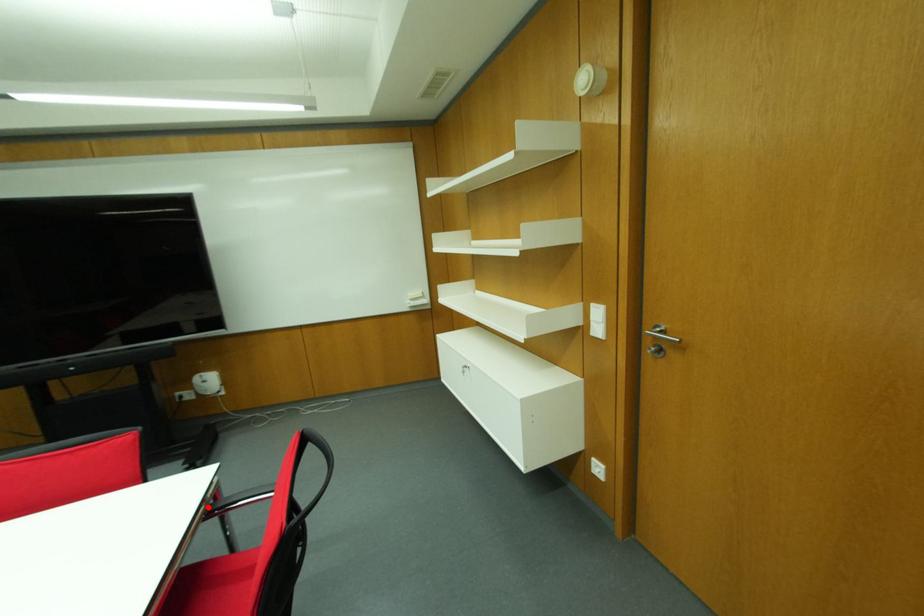
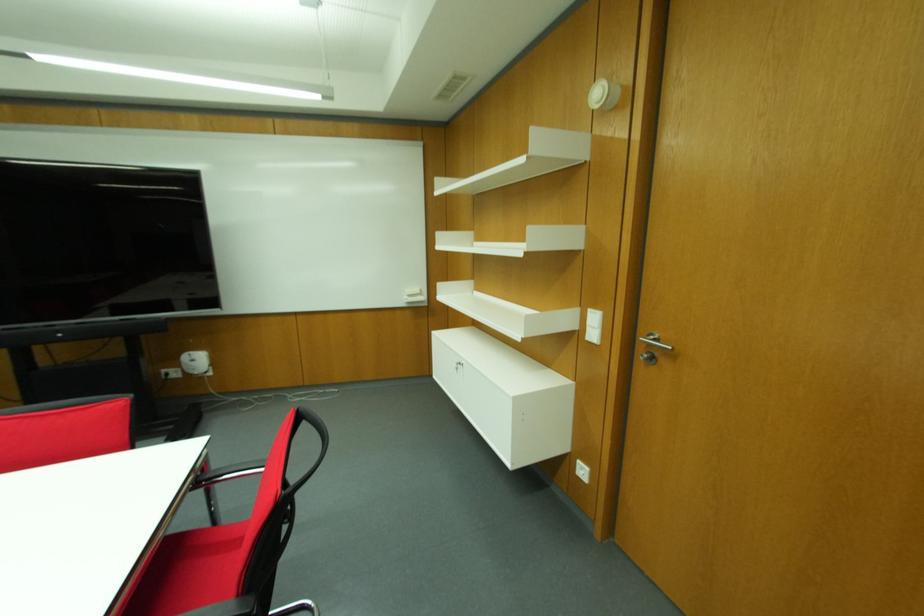
Locate, in the second image, the point that corresponds to the highlighted location in the first image.

(197, 477)